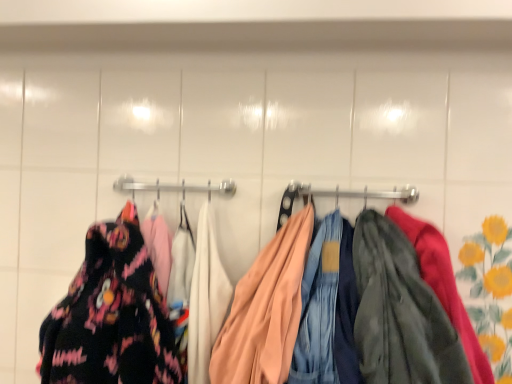
Question: Is matte peach jacket at center a part of floral fabric dress at left?

Choices:
 (A) yes
 (B) no

Answer: (B)

Question: Is floral fabric dress at left smaller than matte peach jacket at center?

Choices:
 (A) yes
 (B) no

Answer: (A)

Question: From the image's perspective, is floral fabric dress at left below matte peach jacket at center?

Choices:
 (A) no
 (B) yes

Answer: (A)

Question: Is floral fabric dress at left positioned beyond the bounds of matte peach jacket at center?

Choices:
 (A) yes
 (B) no

Answer: (A)

Question: Does floral fabric dress at left come in front of matte peach jacket at center?

Choices:
 (A) no
 (B) yes

Answer: (A)

Question: Is floral fabric dress at left at the left side of matte peach jacket at center?

Choices:
 (A) yes
 (B) no

Answer: (A)

Question: Is matte peach jacket at center taller than floral fabric dress at left?

Choices:
 (A) no
 (B) yes

Answer: (A)

Question: From the image's perspective, would you say matte peach jacket at center is shown under floral fabric dress at left?

Choices:
 (A) no
 (B) yes

Answer: (B)

Question: Is matte peach jacket at center positioned in front of floral fabric dress at left?

Choices:
 (A) no
 (B) yes

Answer: (B)

Question: From a real-world perspective, is matte peach jacket at center on floral fabric dress at left?

Choices:
 (A) no
 (B) yes

Answer: (B)

Question: Can you confirm if matte peach jacket at center is wider than floral fabric dress at left?

Choices:
 (A) no
 (B) yes

Answer: (B)

Question: Is matte peach jacket at center shorter than floral fabric dress at left?

Choices:
 (A) no
 (B) yes

Answer: (B)

Question: Considering the positions of point (325, 193) and point (106, 301), is point (325, 193) closer or farther from the camera than point (106, 301)?

Choices:
 (A) farther
 (B) closer

Answer: (A)